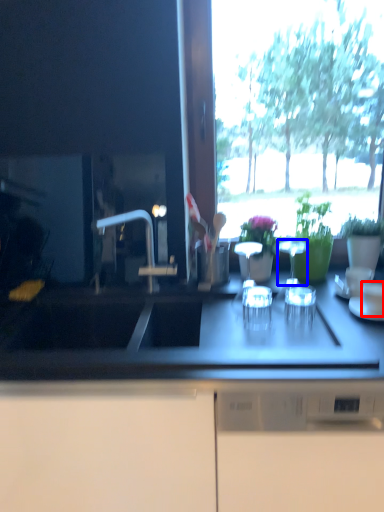
Question: Which object is closer to the camera taking this photo, tableware (highlighted by a red box) or tableware (highlighted by a blue box)?

Choices:
 (A) tableware
 (B) tableware

Answer: (A)